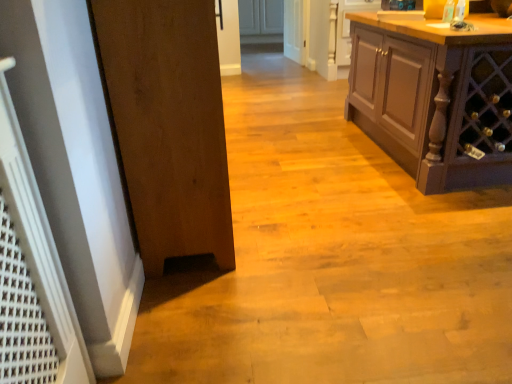
Question: Is wooden door at left at the right side of matte brown cabinet at right?

Choices:
 (A) no
 (B) yes

Answer: (A)

Question: Can you confirm if wooden door at left is shorter than matte brown cabinet at right?

Choices:
 (A) yes
 (B) no

Answer: (B)

Question: Considering the relative sizes of wooden door at left and matte brown cabinet at right in the image provided, is wooden door at left smaller than matte brown cabinet at right?

Choices:
 (A) yes
 (B) no

Answer: (A)

Question: Considering the relative sizes of wooden door at left and matte brown cabinet at right in the image provided, is wooden door at left bigger than matte brown cabinet at right?

Choices:
 (A) yes
 (B) no

Answer: (B)

Question: Does wooden door at left contain matte brown cabinet at right?

Choices:
 (A) no
 (B) yes

Answer: (A)

Question: Looking at their shapes, would you say white glossy door at center is wider or thinner than wooden door at left?

Choices:
 (A) wide
 (B) thin

Answer: (B)

Question: Is white glossy door at center inside or outside of wooden door at left?

Choices:
 (A) inside
 (B) outside

Answer: (B)

Question: Considering the positions of white glossy door at center and wooden door at left in the image, is white glossy door at center taller or shorter than wooden door at left?

Choices:
 (A) tall
 (B) short

Answer: (B)

Question: From the image's perspective, relative to wooden door at left, is white glossy door at center above or below?

Choices:
 (A) below
 (B) above

Answer: (B)

Question: Do you think wooden door at left is within white glossy door at center, or outside of it?

Choices:
 (A) inside
 (B) outside

Answer: (B)

Question: Relative to white glossy door at center, is wooden door at left in front or behind?

Choices:
 (A) front
 (B) behind

Answer: (A)

Question: Is wooden door at left bigger or smaller than white glossy door at center?

Choices:
 (A) big
 (B) small

Answer: (A)

Question: Is wooden door at left to the left or to the right of white glossy door at center in the image?

Choices:
 (A) right
 (B) left

Answer: (B)

Question: Is wooden door at left wider or thinner than matte brown cabinet at right?

Choices:
 (A) thin
 (B) wide

Answer: (A)

Question: Looking at the image, does wooden door at left seem bigger or smaller compared to matte brown cabinet at right?

Choices:
 (A) big
 (B) small

Answer: (B)